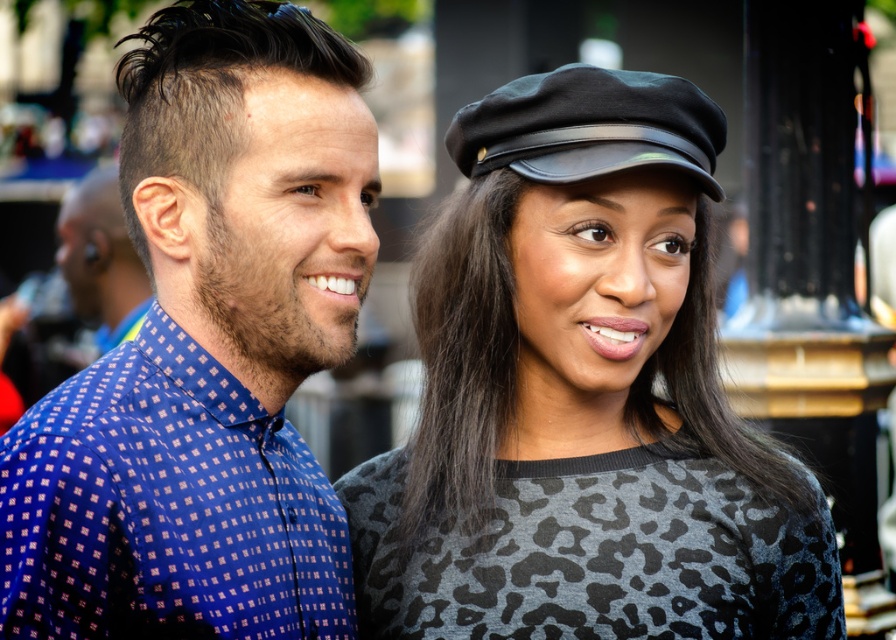
In the scene shown: Who is shorter, blue printed shirt at left or black leather beret at upper center?

With less height is blue printed shirt at left.

Is point (224, 518) less distant than point (573, 173)?

Yes, it is in front of point (573, 173).

This screenshot has height=640, width=896. Find the location of `blue printed shirt at left`. blue printed shirt at left is located at coordinates (207, 349).

Does leopard print sweater at center have a larger size compared to blue printed shirt at left?

Yes, leopard print sweater at center is bigger than blue printed shirt at left.

Is leopard print sweater at center positioned in front of blue printed shirt at left?

No, leopard print sweater at center is further to the viewer.

Is point (716, 634) positioned before point (329, 259)?

No, (716, 634) is behind (329, 259).

Where is `leopard print sweater at center`? This screenshot has width=896, height=640. leopard print sweater at center is located at coordinates (582, 397).

Between leopard print sweater at center and black leather beret at upper center, which one is positioned higher?

black leather beret at upper center is higher up.

Locate an element on the screen. leopard print sweater at center is located at coordinates (582, 397).

Image resolution: width=896 pixels, height=640 pixels. I want to click on leopard print sweater at center, so click(582, 397).

You are a GUI agent. You are given a task and a screenshot of the screen. Output one action in this format:
    pyautogui.click(x=<x>, y=<y>)
    Task: Click on the leopard print sweater at center
    The width and height of the screenshot is (896, 640).
    Given the screenshot: What is the action you would take?
    pyautogui.click(x=582, y=397)